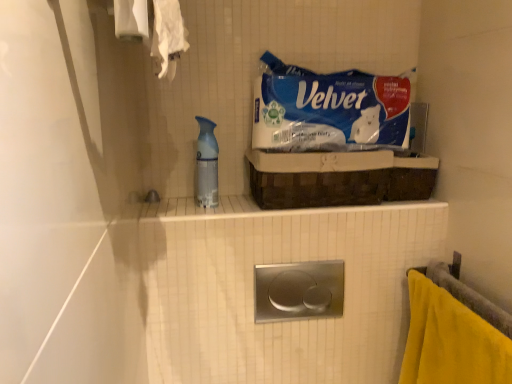
What do you see at coordinates (206, 164) in the screenshot? Image resolution: width=512 pixels, height=384 pixels. I see `translucent plastic spray bottle at center` at bounding box center [206, 164].

You are a GUI agent. You are given a task and a screenshot of the screen. Output one action in this format:
    pyautogui.click(x=<x>, y=<y>)
    Task: Click on the blue paper towel at upper center
    The image size is (512, 384).
    Given the screenshot: What is the action you would take?
    pyautogui.click(x=329, y=110)

In order to click on translucent plastic spray bottle at center in this screenshot , I will do `click(206, 164)`.

Which of these two, blue paper towel at upper center or yellow fabric towel at lower right, stands shorter?

blue paper towel at upper center is shorter.

In the image, is blue paper towel at upper center positioned in front of or behind yellow fabric towel at lower right?

In the image, blue paper towel at upper center appears behind yellow fabric towel at lower right.

Is yellow fabric towel at lower right located within blue paper towel at upper center?

No, yellow fabric towel at lower right is not surrounded by blue paper towel at upper center.

Who is bigger, blue paper towel at upper center or yellow fabric towel at lower right?

With larger size is yellow fabric towel at lower right.

Is brown woven basket at upper center at the back of translucent plastic spray bottle at center?

No.

Looking at this image, is translucent plastic spray bottle at center taller than brown woven basket at upper center?

Indeed, translucent plastic spray bottle at center has a greater height compared to brown woven basket at upper center.

From the image's perspective, which is below, translucent plastic spray bottle at center or brown woven basket at upper center?

brown woven basket at upper center is shown below in the image.

Between translucent plastic spray bottle at center and brown woven basket at upper center, which one has larger width?

brown woven basket at upper center is wider.

How distant is translucent plastic spray bottle at center from blue paper towel at upper center?

translucent plastic spray bottle at center is 11.67 inches from blue paper towel at upper center.

Is translucent plastic spray bottle at center spatially inside blue paper towel at upper center, or outside of it?

translucent plastic spray bottle at center is outside blue paper towel at upper center.

Considering the relative sizes of translucent plastic spray bottle at center and blue paper towel at upper center in the image provided, is translucent plastic spray bottle at center shorter than blue paper towel at upper center?

No, translucent plastic spray bottle at center is not shorter than blue paper towel at upper center.

Considering the relative sizes of translucent plastic spray bottle at center and blue paper towel at upper center in the image provided, is translucent plastic spray bottle at center smaller than blue paper towel at upper center?

Yes.

Is blue paper towel at upper center aimed at polished stainless steel flush plate at center?

No.

Can you tell me how much blue paper towel at upper center and polished stainless steel flush plate at center differ in facing direction?

0.753 degrees.

Does blue paper towel at upper center touch polished stainless steel flush plate at center?

No, blue paper towel at upper center is not beside polished stainless steel flush plate at center.

Is blue paper towel at upper center smaller than polished stainless steel flush plate at center?

Yes.

Considering the sizes of polished stainless steel flush plate at center and blue paper towel at upper center in the image, is polished stainless steel flush plate at center wider or thinner than blue paper towel at upper center?

Clearly, polished stainless steel flush plate at center has less width compared to blue paper towel at upper center.

Does point (175, 252) appear closer or farther from the camera than point (408, 127)?

Point (175, 252).

Is polished stainless steel flush plate at center positioned behind blue paper towel at upper center?

That is False.

The image size is (512, 384). Identify the location of bath in front of the blue paper towel at upper center. (253, 290).

Which is closer, (405,132) or (254,156)?

The point (254,156) is closer to the camera.

Is the position of blue paper towel at upper center less distant than that of brown woven basket at upper center?

No, blue paper towel at upper center is behind brown woven basket at upper center.

From a real-world perspective, is blue paper towel at upper center positioned above or below brown woven basket at upper center?

blue paper towel at upper center is situated higher than brown woven basket at upper center in the real world.

How far apart are blue paper towel at upper center and brown woven basket at upper center?

4.69 inches.

Looking at this image, how much distance is there between polished stainless steel flush plate at center and translucent plastic spray bottle at center?

polished stainless steel flush plate at center and translucent plastic spray bottle at center are 13.66 inches apart.

Which is in front, point (362, 318) or point (210, 135)?

Point (210, 135)

Choose the correct answer: Is polished stainless steel flush plate at center inside translucent plastic spray bottle at center or outside it?

polished stainless steel flush plate at center is not inside translucent plastic spray bottle at center, it's outside.

From the image's perspective, who appears lower, polished stainless steel flush plate at center or translucent plastic spray bottle at center?

polished stainless steel flush plate at center.

You are a GUI agent. You are given a task and a screenshot of the screen. Output one action in this format:
    pyautogui.click(x=<x>, y=<y>)
    Task: Click on the towel below the blue paper towel at upper center (from the image's perspective)
    This screenshot has height=384, width=512.
    Given the screenshot: What is the action you would take?
    pyautogui.click(x=451, y=341)

Locate an element on the screen. This screenshot has width=512, height=384. basket in front of the translucent plastic spray bottle at center is located at coordinates (318, 178).

When comparing their distances from brown woven basket at upper center, does polished stainless steel flush plate at center or translucent plastic spray bottle at center seem closer?

polished stainless steel flush plate at center is closer to brown woven basket at upper center.

Considering their positions, is polished stainless steel flush plate at center positioned closer to translucent plastic spray bottle at center than yellow fabric towel at lower right?

Among the two, polished stainless steel flush plate at center is located nearer to translucent plastic spray bottle at center.

From the picture: Which object lies nearer to the anchor point translucent plastic spray bottle at center, yellow fabric towel at lower right or polished stainless steel flush plate at center?

polished stainless steel flush plate at center is closer to translucent plastic spray bottle at center.

Looking at the image, which one is located further to yellow fabric towel at lower right, blue paper towel at upper center or polished stainless steel flush plate at center?

Among the two, blue paper towel at upper center is located further to yellow fabric towel at lower right.

From the image, which object appears to be nearer to brown woven basket at upper center, translucent plastic spray bottle at center or blue paper towel at upper center?

Based on the image, blue paper towel at upper center appears to be nearer to brown woven basket at upper center.

From the image, which object appears to be farther from brown woven basket at upper center, blue paper towel at upper center or translucent plastic spray bottle at center?

translucent plastic spray bottle at center is further to brown woven basket at upper center.

Considering their positions, is yellow fabric towel at lower right positioned further to polished stainless steel flush plate at center than translucent plastic spray bottle at center?

translucent plastic spray bottle at center lies further to polished stainless steel flush plate at center than the other object.

From the image, which object appears to be farther from brown woven basket at upper center, yellow fabric towel at lower right or blue paper towel at upper center?

The object further to brown woven basket at upper center is yellow fabric towel at lower right.

Locate an element on the screen. The width and height of the screenshot is (512, 384). cleaning product that lies between blue paper towel at upper center and yellow fabric towel at lower right from top to bottom is located at coordinates (206, 164).

This screenshot has height=384, width=512. I want to click on product situated between translucent plastic spray bottle at center and brown woven basket at upper center from left to right, so click(x=329, y=110).

Where is `basket between translucent plastic spray bottle at center and yellow fabric towel at lower right from left to right`? basket between translucent plastic spray bottle at center and yellow fabric towel at lower right from left to right is located at coordinates (318, 178).

Locate an element on the screen. cleaning product between blue paper towel at upper center and polished stainless steel flush plate at center in the vertical direction is located at coordinates (206, 164).